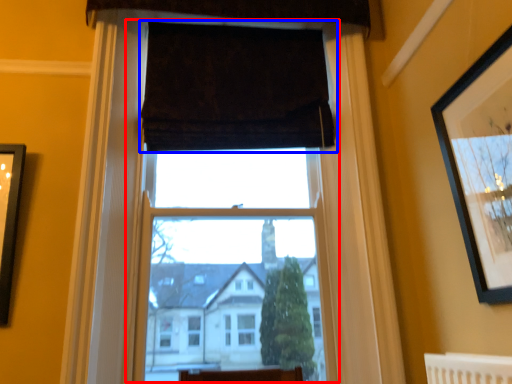
Question: Which point is closer to the camera, window frame (highlighted by a red box) or curtain (highlighted by a blue box)?

Choices:
 (A) window frame
 (B) curtain

Answer: (A)